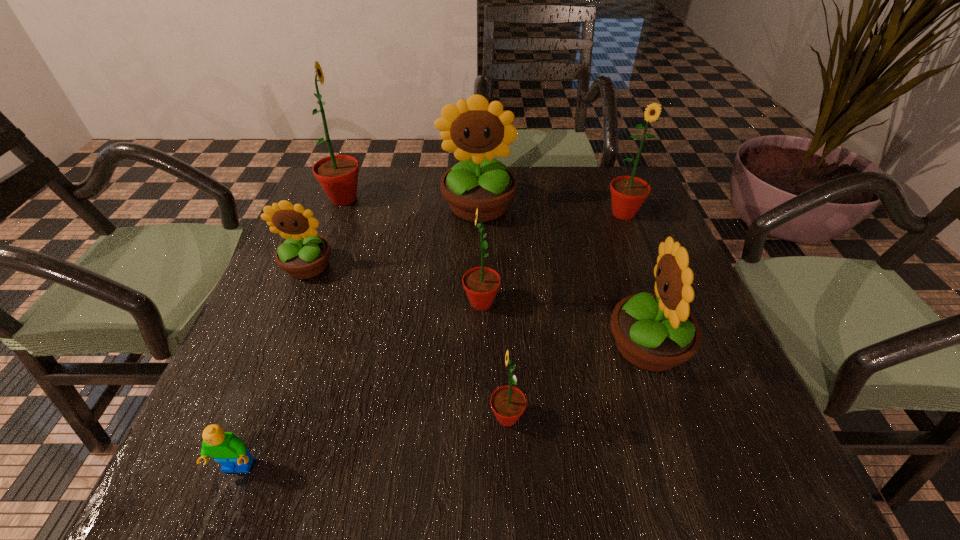
This screenshot has height=540, width=960. I want to click on sunflower that stands as the second closest to the nearest object, so click(x=304, y=254).

Where is `green sunflower that stands as the second closest to the nearest green sunflower`? green sunflower that stands as the second closest to the nearest green sunflower is located at coordinates (628, 193).

Select which green sunflower is the third closest to the nearest object. Please provide its 2D coordinates. Your answer should be formatted as a tuple, i.e. [(x, y)], where the tuple contains the x and y coordinates of a point satisfying the conditions above.

[(338, 174)]

Locate an element on the screen. yellow sunflower that is the third closest to the nearest object is located at coordinates (475, 131).

Identify which yellow sunflower is the closest to the second yellow sunflower from right to left. Please provide its 2D coordinates. Your answer should be formatted as a tuple, i.e. [(x, y)], where the tuple contains the x and y coordinates of a point satisfying the conditions above.

[(304, 254)]

The image size is (960, 540). Identify the location of free space that satisfies the following two spatial constraints: 1. on the face of the nearest green sunflower; 2. on the face of the green Lego. (510, 468).

Find the location of a particular element. The width and height of the screenshot is (960, 540). vacant area in the image that satisfies the following two spatial constraints: 1. on the face of the second biggest yellow sunflower; 2. on the face of the nearest object is located at coordinates (688, 468).

I want to click on free spot that satisfies the following two spatial constraints: 1. on the face of the tallest sunflower; 2. on the face of the smallest yellow sunflower, so click(x=318, y=266).

The width and height of the screenshot is (960, 540). What are the coordinates of `free space that satisfies the following two spatial constraints: 1. on the face of the second biggest green sunflower; 2. on the face of the second smallest green sunflower` in the screenshot? It's located at (659, 302).